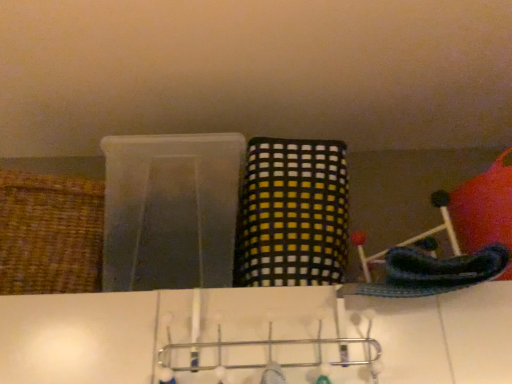
Question: Which direction should I rotate to look at yellow checkered fabric basket at center, which appears as the 2th basket when viewed from the left, — up or down?

Choices:
 (A) down
 (B) up

Answer: (A)

Question: Is woven brown basket at left, which ranks as the 1th basket in left-to-right order, further to camera compared to metallic silver hanger at center?

Choices:
 (A) no
 (B) yes

Answer: (B)

Question: Does woven brown basket at left, which ranks as the second basket in right-to-left order, contain metallic silver hanger at center?

Choices:
 (A) no
 (B) yes

Answer: (A)

Question: Is woven brown basket at left, which ranks as the 1th basket in left-to-right order, outside metallic silver hanger at center?

Choices:
 (A) no
 (B) yes

Answer: (B)

Question: From a real-world perspective, is woven brown basket at left, which ranks as the second basket in right-to-left order, under metallic silver hanger at center?

Choices:
 (A) yes
 (B) no

Answer: (B)

Question: Can you confirm if woven brown basket at left, which ranks as the 1th basket in left-to-right order, is thinner than metallic silver hanger at center?

Choices:
 (A) yes
 (B) no

Answer: (B)

Question: Can you confirm if woven brown basket at left, which ranks as the second basket in right-to-left order, is taller than metallic silver hanger at center?

Choices:
 (A) no
 (B) yes

Answer: (B)

Question: Can you confirm if metallic silver hanger at center is taller than woven brown basket at left, which ranks as the second basket in right-to-left order?

Choices:
 (A) yes
 (B) no

Answer: (B)

Question: Is metallic silver hanger at center outside of woven brown basket at left, which ranks as the 1th basket in left-to-right order?

Choices:
 (A) yes
 (B) no

Answer: (A)

Question: Does metallic silver hanger at center appear on the left side of woven brown basket at left, which ranks as the 1th basket in left-to-right order?

Choices:
 (A) no
 (B) yes

Answer: (A)

Question: From the image's perspective, does metallic silver hanger at center appear lower than woven brown basket at left, which ranks as the second basket in right-to-left order?

Choices:
 (A) no
 (B) yes

Answer: (B)

Question: Is metallic silver hanger at center oriented towards woven brown basket at left, which ranks as the 1th basket in left-to-right order?

Choices:
 (A) yes
 (B) no

Answer: (B)

Question: Does metallic silver hanger at center touch woven brown basket at left, which ranks as the 1th basket in left-to-right order?

Choices:
 (A) yes
 (B) no

Answer: (B)

Question: Is there a large distance between yellow checkered fabric basket at center, which appears as the 2th basket when viewed from the left, and woven brown basket at left, which ranks as the 1th basket in left-to-right order?

Choices:
 (A) no
 (B) yes

Answer: (A)